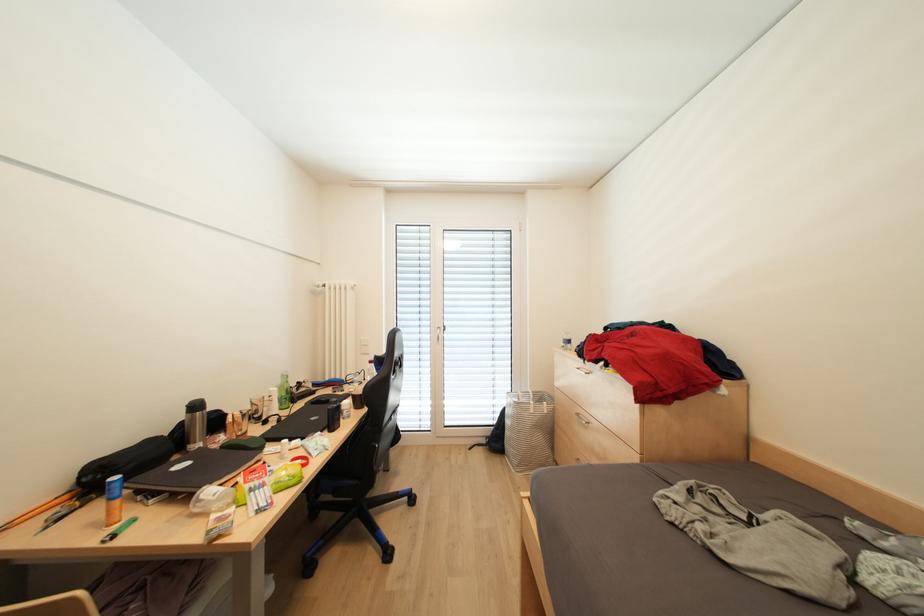
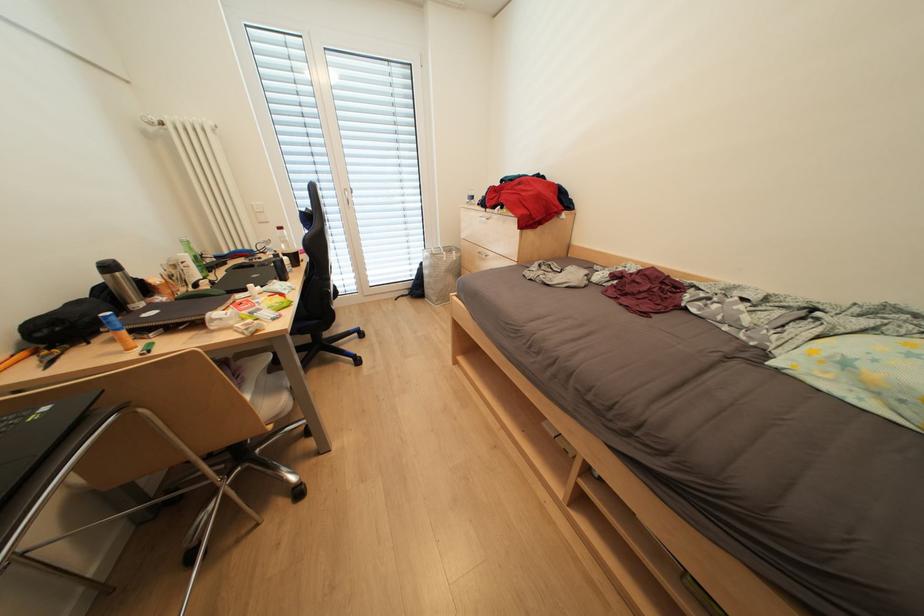
Based on the continuous images, in which direction is the camera rotating?

The rotation direction of the camera is right-down.